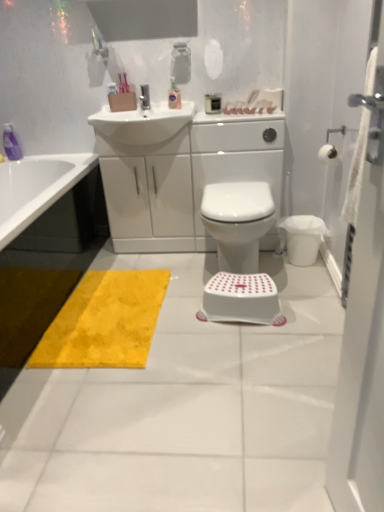
Identify the location of free location to the right of white plastic step stool at center. Image resolution: width=384 pixels, height=512 pixels. (309, 304).